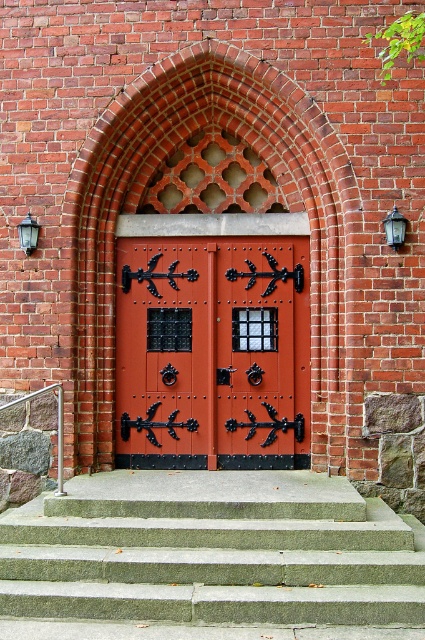
Question: Can you confirm if gray concrete stairs at center is positioned to the right of matte red door at center?

Choices:
 (A) no
 (B) yes

Answer: (B)

Question: Among these points, which one is farthest from the camera?

Choices:
 (A) click(265, 586)
 (B) click(59, 388)
 (C) click(158, 422)

Answer: (C)

Question: Does matte red door at center have a smaller size compared to red brick archway at center?

Choices:
 (A) no
 (B) yes

Answer: (B)

Question: Does red brick archway at center appear under metallic silver railing at lower left?

Choices:
 (A) yes
 (B) no

Answer: (B)

Question: Which of the following is the farthest from the observer?

Choices:
 (A) red brick archway at center
 (B) matte red door at center
 (C) gray concrete stairs at center

Answer: (B)

Question: Which object appears closest to the camera in this image?

Choices:
 (A) red brick archway at center
 (B) gray concrete stairs at center
 (C) matte red door at center
 (D) metallic silver railing at lower left

Answer: (B)